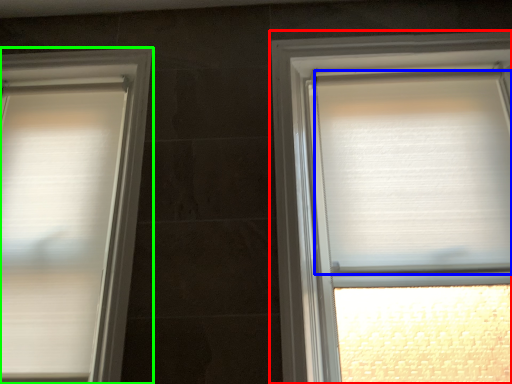
Question: Which is nearer to the window (highlighted by a red box)? blind (highlighted by a blue box) or window (highlighted by a green box).

Choices:
 (A) blind
 (B) window

Answer: (A)